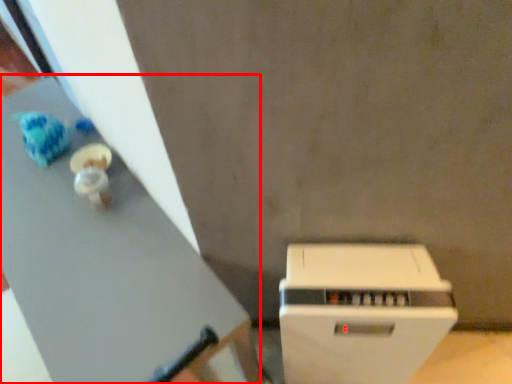
Question: Considering the relative positions of table (annotated by the red box) and home appliance in the image provided, where is table (annotated by the red box) located with respect to the staircase?

Choices:
 (A) left
 (B) right

Answer: (A)